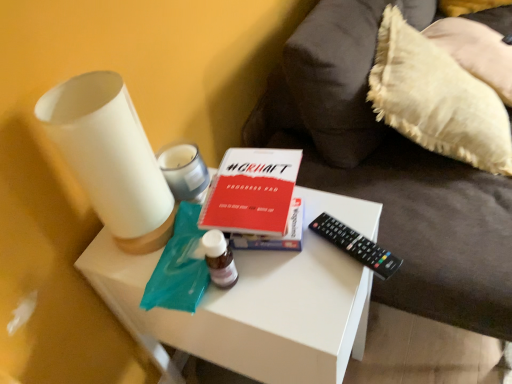
This screenshot has height=384, width=512. Find the location of `empty space that is ontop of white matte table at center (from a real-world perspective)`. empty space that is ontop of white matte table at center (from a real-world perspective) is located at coordinates (261, 254).